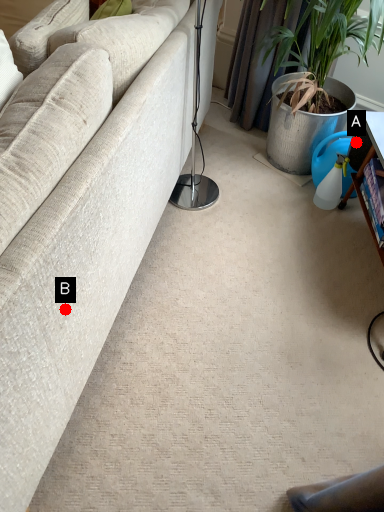
Question: Two points are circled on the image, labeled by A and B beside each circle. Which of the following is the farthest from the observer?

Choices:
 (A) A is further
 (B) B is further

Answer: (A)